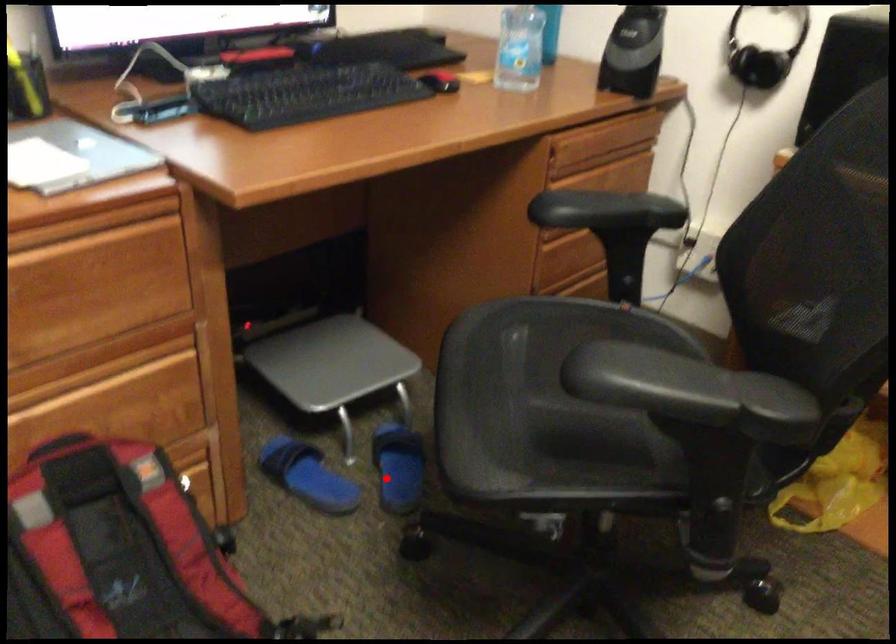
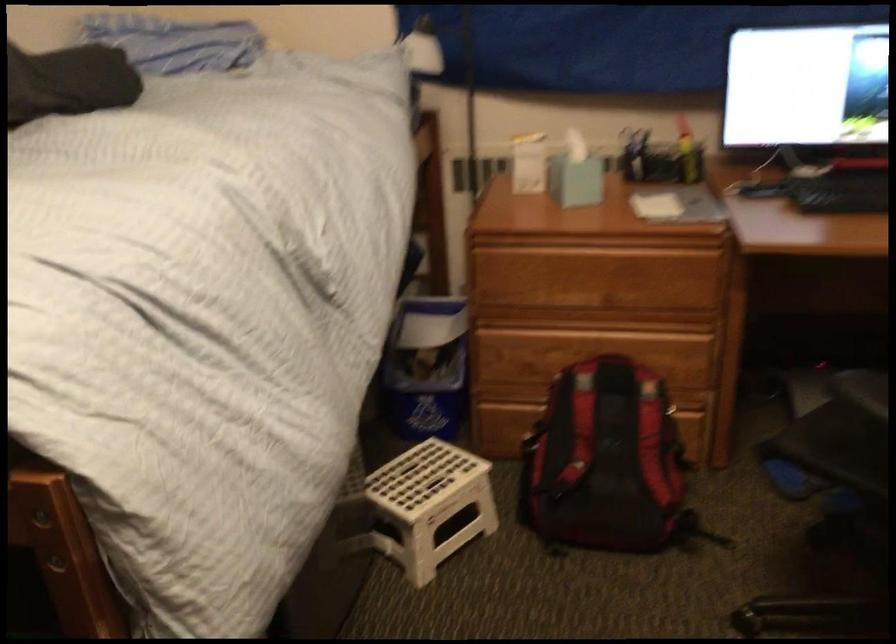
Question: I am providing you with two images of the same scene from different viewpoints. A red point is marked on the first image. Is the red point's position out of view in image 2?

Choices:
 (A) Yes
 (B) No

Answer: (B)